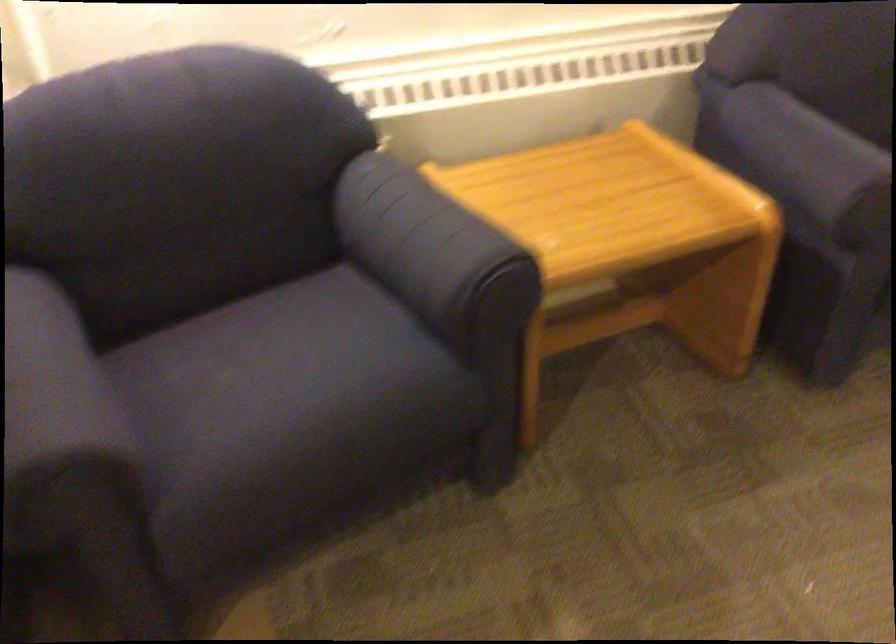
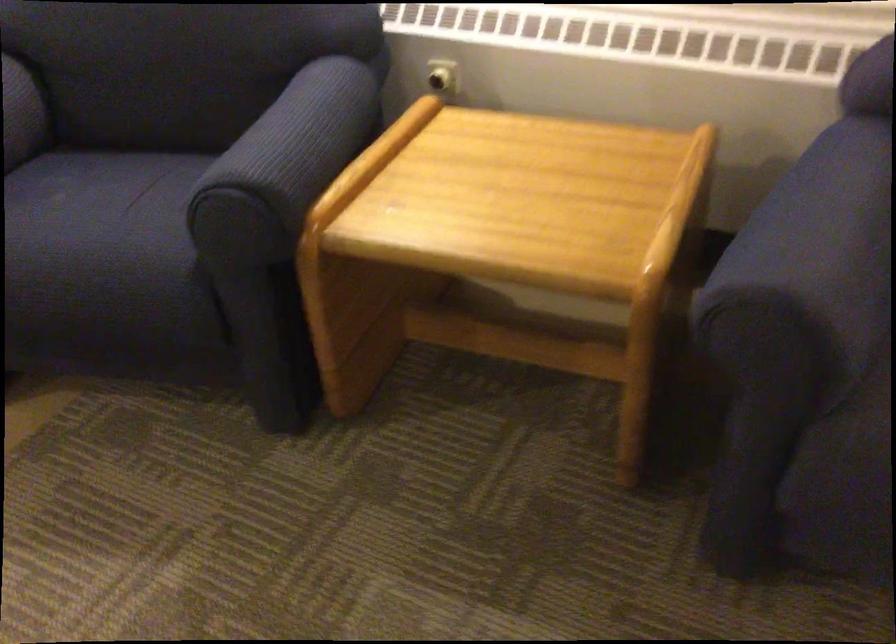
In the second image, find the point that corresponds to the point at 330,377 in the first image.

(99, 232)